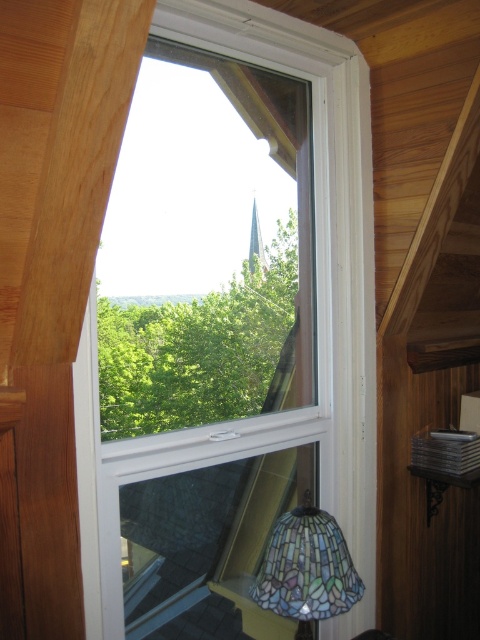
Between clear glass window at center and stained glass lampshade at lower right, which one appears on the left side from the viewer's perspective?

From the viewer's perspective, clear glass window at center appears more on the left side.

Does clear glass window at center appear over stained glass lampshade at lower right?

Yes, clear glass window at center is above stained glass lampshade at lower right.

Is point (146, 288) less distant than point (320, 516)?

That is False.

Identify the location of clear glass window at center. This screenshot has height=640, width=480. (228, 324).